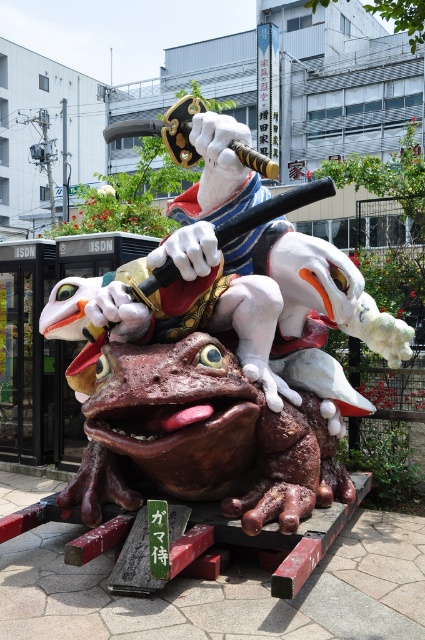
You are standing in front of the kappa statue and want to place two markers at the specified coordinates. The first marker is at point (x=183, y=140) and the second is at point (x=59, y=496). Which marker will be closer to you?

Point (x=59, y=496) is closer to you because it is in front of point (x=183, y=140).

You are an art curator planning to display both the shiny metallic statue at center and the shiny white octopus at center in a new exhibition. Based on their positions in the image, which object is placed higher up?

The shiny metallic statue at center is positioned over the shiny white octopus at center, so it is placed higher up.

You are an art curator planning to install a new exhibit featuring the shiny metallic statue at center and the shiny white octopus at center. According to the scene description, which object is positioned to the right side of the other?

The shiny metallic statue at center is to the left of the shiny white octopus at center, so the shiny white octopus at center is positioned to the right side of the shiny metallic statue at center.